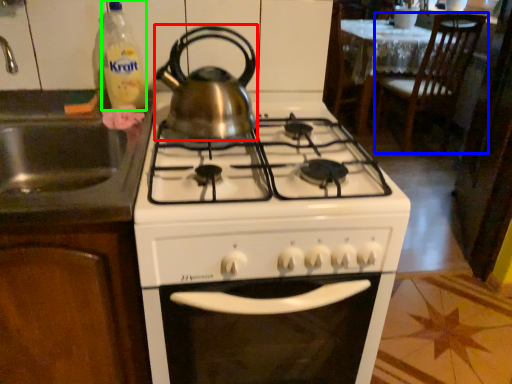
Question: Which object is positioned farthest from kitchen appliance (highlighted by a red box)? Select from chair (highlighted by a blue box) and bottle (highlighted by a green box).

Choices:
 (A) chair
 (B) bottle

Answer: (A)